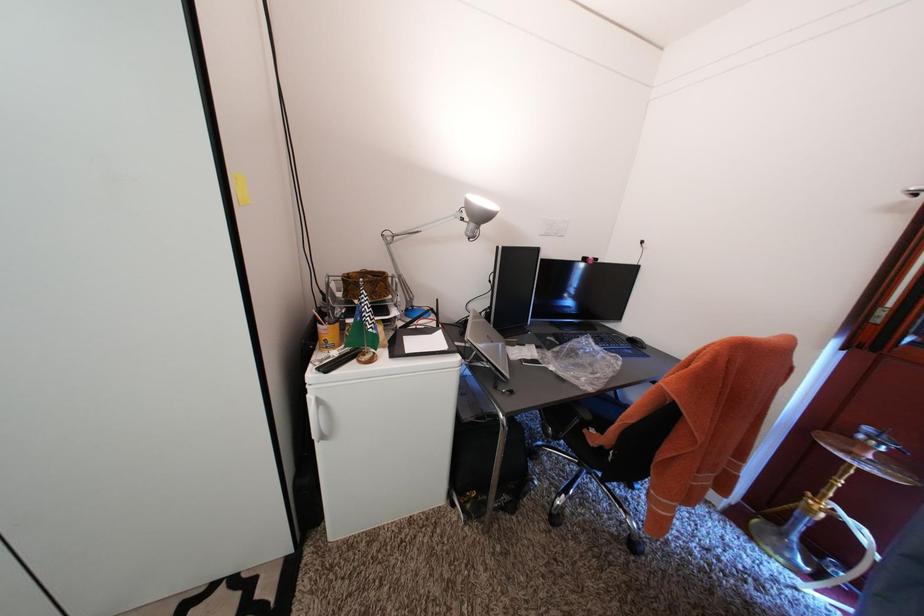
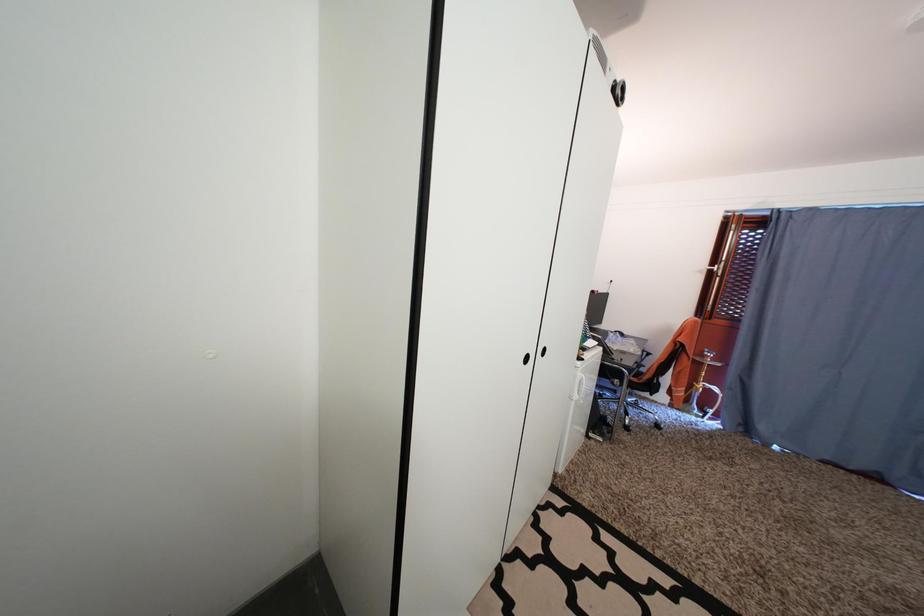
Question: Which direction would the cameraman need to move to produce the second image? Reply with the corresponding letter.

Choices:
 (A) Left
 (B) Right
 (C) Forward
 (D) Backward

Answer: (A)